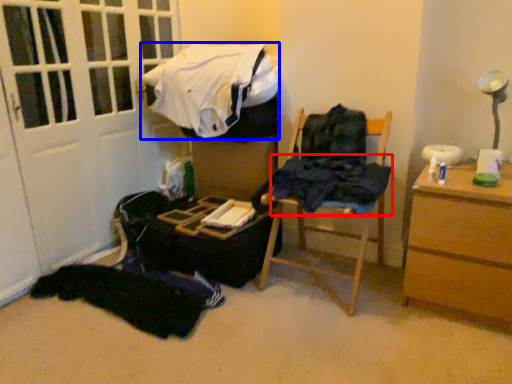
Question: Which point is closer to the camera, clothing (highlighted by a red box) or clothing (highlighted by a blue box)?

Choices:
 (A) clothing
 (B) clothing

Answer: (A)